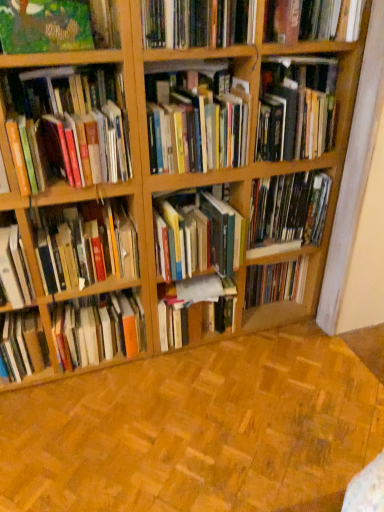
Question: In terms of size, does hardcover book at upper right, the thirteenth book when ordered from bottom to top, appear bigger or smaller than hardcover book at center, which is the twelfth book from top to bottom?

Choices:
 (A) small
 (B) big

Answer: (A)

Question: Is hardcover book at upper right, which is counted as the 1th book, starting from the top, in front of or behind hardcover book at center, acting as the 2th book starting from the bottom, in the image?

Choices:
 (A) front
 (B) behind

Answer: (A)

Question: Estimate the real-world distances between objects in this image. Which object is closer to the hardcover books at left, acting as the 8th book starting from the bottom?

Choices:
 (A) hardcover book at center, which is the twelfth book from top to bottom
 (B) hardcover books at center, placed as the 5th book when sorted from top to bottom
 (C) hardcover books at center, the eighth book from the top
 (D) hardcover book at upper right, the thirteenth book when ordered from bottom to top
 (E) hardcover book at upper right, marked as the fourth book in a top-to-bottom arrangement

Answer: (B)

Question: Which of these objects is positioned farthest from the hardcover book at center, positioned as the eleventh book in top-to-bottom order?

Choices:
 (A) hardcover book at upper right, the thirteenth book when ordered from bottom to top
 (B) hardcover book at upper center, acting as the 12th book starting from the bottom
 (C) hardcover book at upper right, marked as the fourth book in a top-to-bottom arrangement
 (D) green matte painting at upper left, which appears as the third book when viewed from the top
 (E) hardcover books at left, the 6th book in the top-to-bottom sequence

Answer: (D)